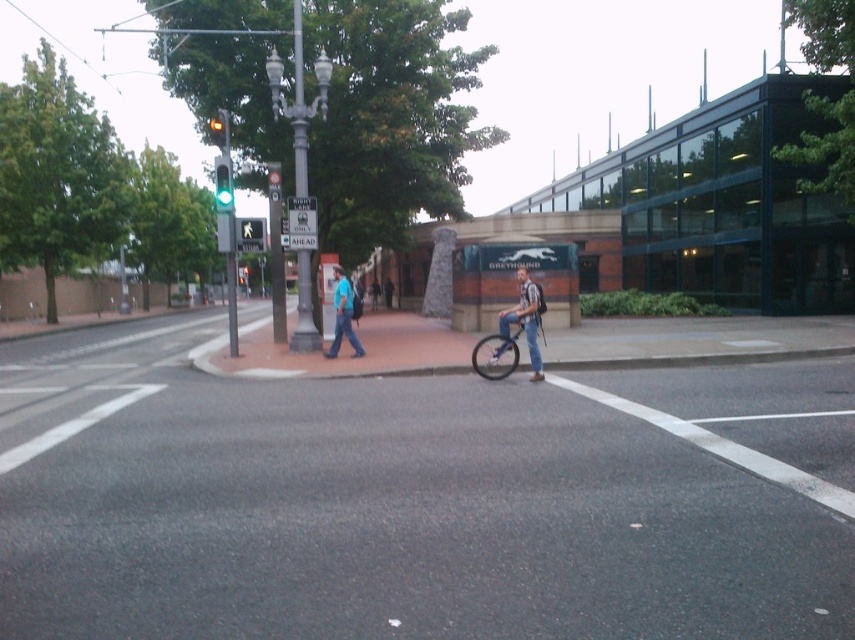
This screenshot has width=855, height=640. What do you see at coordinates (497, 353) in the screenshot? I see `metallic silver bicycle at center` at bounding box center [497, 353].

Between point (478, 342) and point (264, 230), which one is positioned behind?

Point (264, 230)

Identify the location of metallic silver bicycle at center. (497, 353).

Based on the photo, is metallic silver bicycle at center closer to camera compared to green glass traffic light at upper center?

Result: That is True.

In the scene shown: Is metallic silver bicycle at center positioned at the back of green glass traffic light at upper center?

No, it is not.

Is point (491, 371) less distant than point (217, 120)?

Yes, point (491, 371) is in front of point (217, 120).

Locate an element on the screen. metallic silver bicycle at center is located at coordinates (497, 353).

Which is more to the right, green glass traffic light at upper left or green glass traffic light at upper center?

green glass traffic light at upper center is more to the right.

Is point (223, 202) closer to camera compared to point (219, 120)?

Yes.

Where is `green glass traffic light at upper left`? This screenshot has width=855, height=640. green glass traffic light at upper left is located at coordinates (223, 182).